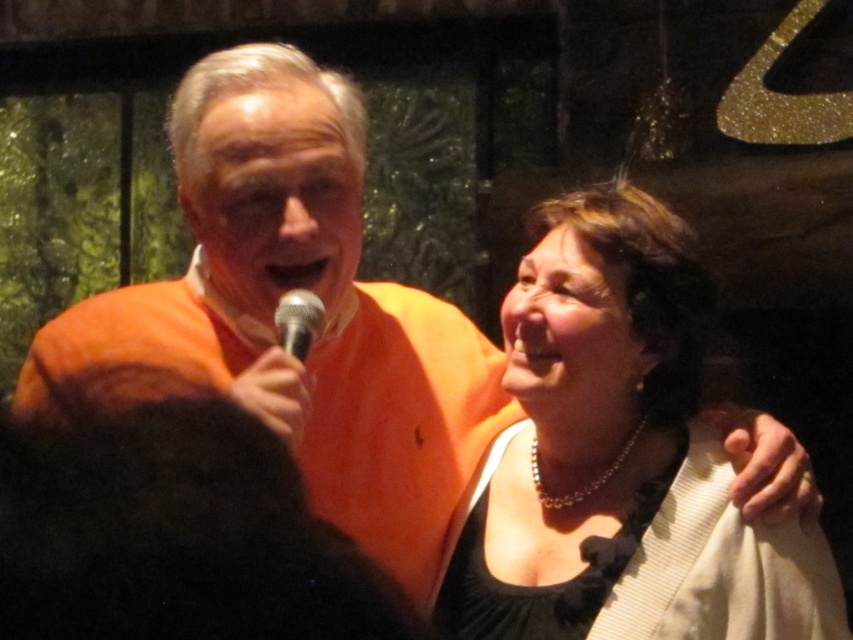
Based on the photo, you are taking a photo of two people in the scene. You want to focus on the person closer to the camera. Which point should you focus on, point (498, 508) or point (300, 310)?

Point (498, 508) is further to the camera than point (300, 310). Therefore, to focus on the person closer to the camera, you should focus on point (300, 310).

You are organizing a small event and need to arrange a dress and a microphone on a table. The table has limited space. Based on the image, which object, the matte black dress at center or the silver metallic microphone at center, is wider and should be placed first to ensure they both fit?

The matte black dress at center might be wider than the silver metallic microphone at center, so it should be placed first on the table to ensure both fit.

You are a photographer trying to capture the perfect shot of the scene. The matte black dress at center is crucial for the composition. Where exactly should you focus your camera to ensure the dress is in the frame?

To ensure the matte black dress at center is in the frame, focus your camera at the 2D coordinates point mentioned in the description, which is at point (619, 458).